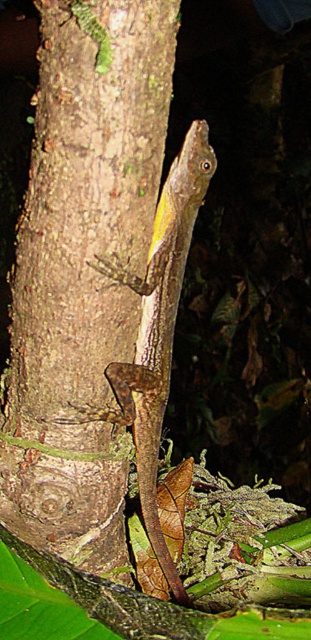
You are a photographer trying to capture a closeup of the brown textured lizard at center. Since the brown rough tree trunk at center is in the way, can you move the trunk to get a better shot?

The brown rough tree trunk at center is closer to the viewer than the brown textured lizard at center, so you cannot move the trunk to get a better shot without adjusting your position or angle.

You are a photographer aiming to capture the brown textured lizard at center and the brown rough tree trunk at center in a single shot. Based on their positions, which object should you adjust your camera focus to first to ensure both are in frame?

The brown rough tree trunk at center is to the left of the brown textured lizard at center, so you should adjust your camera focus to the brown textured lizard at center first to ensure both are in frame.

You are a photographer trying to capture the lizard on the tree trunk. The tree trunk is at point (82, 272). If you want to focus on the lizard, should you adjust your camera focus to a point closer to the center of the image or farther away from the center?

The brown rough tree trunk at center is located at point (82, 272). Since the lizard is clinging vertically to the tree trunk, it is likely positioned at the same point as the trunk. Therefore, to focus on the lizard, you should adjust your camera focus to the center of the image where the trunk is located.